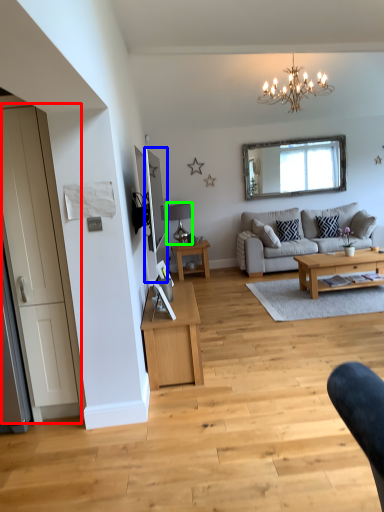
Question: Considering the real-world distances, which object is closest to door (highlighted by a red box)? mirror (highlighted by a blue box) or lamp (highlighted by a green box).

Choices:
 (A) mirror
 (B) lamp

Answer: (A)